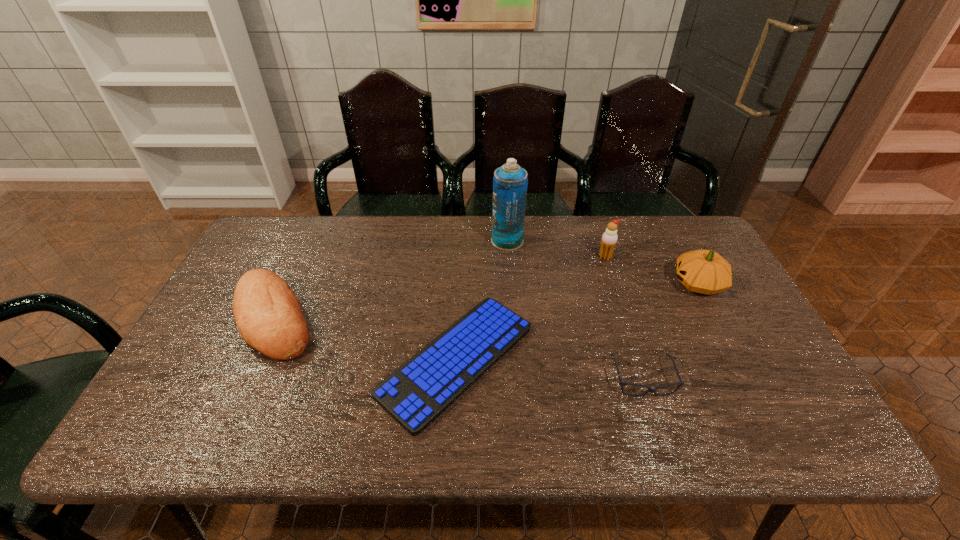
The width and height of the screenshot is (960, 540). I want to click on vacant space in between the tallest object and the bread, so click(391, 280).

In order to click on free space between the second shortest object and the computer keyboard in this screenshot , I will do `click(549, 369)`.

Locate an element on the screen. free space between the third shortest object and the shortest object is located at coordinates click(366, 340).

Where is `the fourth closest object relative to the rightmost object`? the fourth closest object relative to the rightmost object is located at coordinates (420, 390).

Locate an element on the screen. the second closest object relative to the spectacles is located at coordinates (703, 271).

The image size is (960, 540). What are the coordinates of `free space in the image that satisfies the following two spatial constraints: 1. on the front side of the leftmost object; 2. on the left side of the shortest object` in the screenshot? It's located at (256, 360).

Locate an element on the screen. The height and width of the screenshot is (540, 960). vacant position in the image that satisfies the following two spatial constraints: 1. on the side of the rightmost object with the carved face; 2. on the front-facing side of the spectacles is located at coordinates (748, 379).

Locate an element on the screen. The image size is (960, 540). vacant space that satisfies the following two spatial constraints: 1. on the side of the fourth shortest object with the carved face; 2. on the front-facing side of the spectacles is located at coordinates (748, 379).